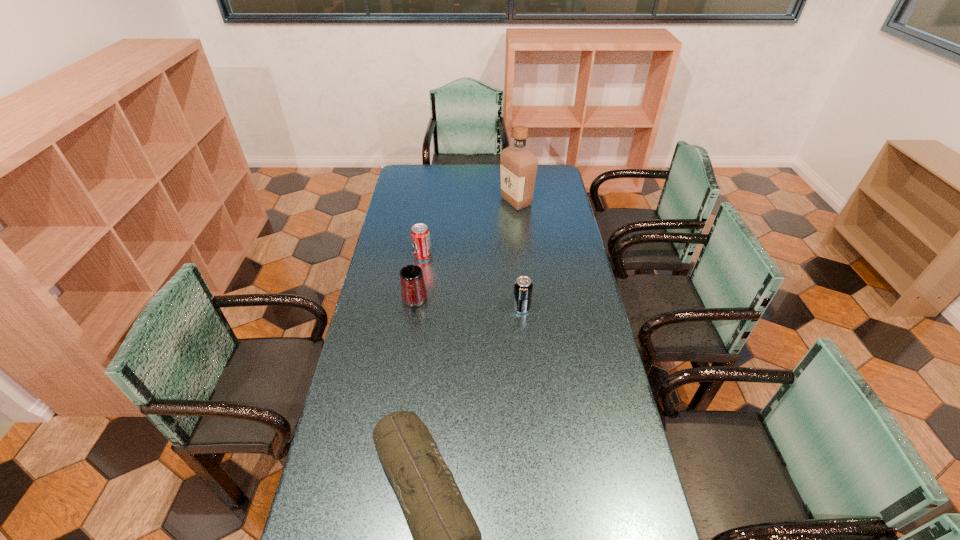
You are a GUI agent. You are given a task and a screenshot of the screen. Output one action in this format:
    pyautogui.click(x=<x>, y=<y>)
    Task: Click on the vacant space that is in between the nearer soda can and the tallest object
    
    Given the screenshot: What is the action you would take?
    pyautogui.click(x=518, y=255)

Locate an element on the screen. The width and height of the screenshot is (960, 540). the fourth closest object to the left soda can is located at coordinates (447, 539).

Locate which object ranks third in proximity to the duffel bag. Please provide its 2D coordinates. Your answer should be formatted as a tuple, i.e. [(x, y)], where the tuple contains the x and y coordinates of a point satisfying the conditions above.

[(420, 235)]

What are the coordinates of `vacant point that satisfies the following two spatial constraints: 1. on the front-facing side of the tallest object; 2. on the side of the mug with the handle` in the screenshot? It's located at (527, 302).

You are a GUI agent. You are given a task and a screenshot of the screen. Output one action in this format:
    pyautogui.click(x=<x>, y=<y>)
    Task: Click on the vacant area that satisfies the following two spatial constraints: 1. on the front-facing side of the tallest object; 2. on the front side of the fourth nearest object
    The width and height of the screenshot is (960, 540).
    Given the screenshot: What is the action you would take?
    pyautogui.click(x=522, y=256)

What are the coordinates of `free space that satisfies the following two spatial constraints: 1. on the side of the right soda can with the handle; 2. on the right side of the mug` in the screenshot? It's located at (414, 308).

You are a GUI agent. You are given a task and a screenshot of the screen. Output one action in this format:
    pyautogui.click(x=<x>, y=<y>)
    Task: Click on the free point that satisfies the following two spatial constraints: 1. on the front-facing side of the tallest object; 2. on the side of the mug with the handle
    
    Given the screenshot: What is the action you would take?
    pyautogui.click(x=527, y=302)